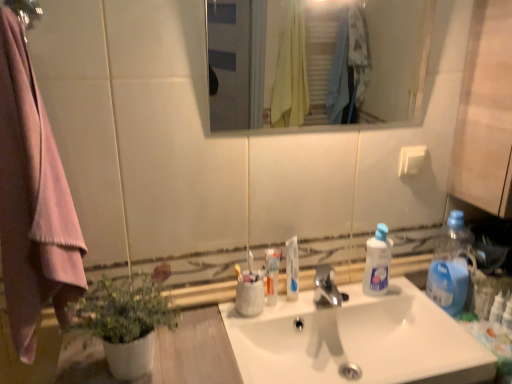
Locate an element on the screen. This screenshot has height=384, width=512. vacant space situated on the left part of white glossy toothpaste at center, the 1th toothpaste from the left is located at coordinates (210, 325).